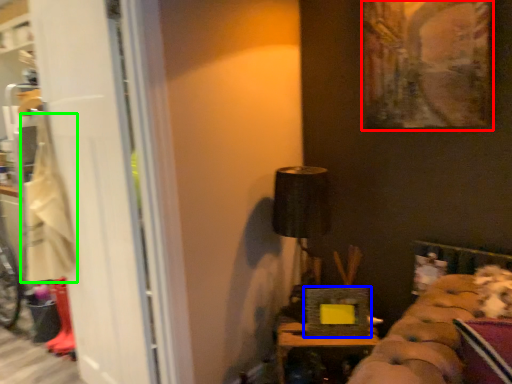
Question: Which is farther away from picture frame (highlighted by a red box)? picture frame (highlighted by a blue box) or laundry (highlighted by a green box)?

Choices:
 (A) picture frame
 (B) laundry

Answer: (B)